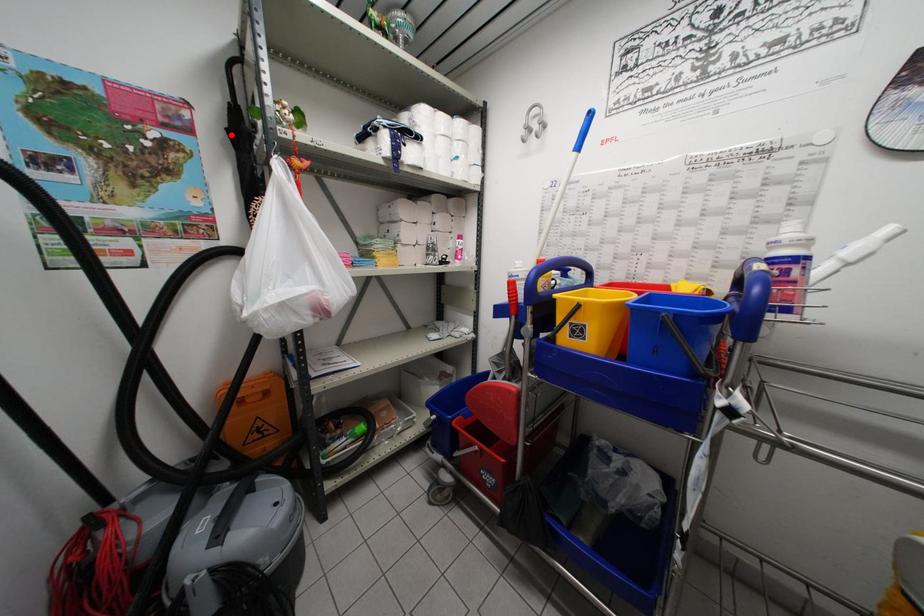
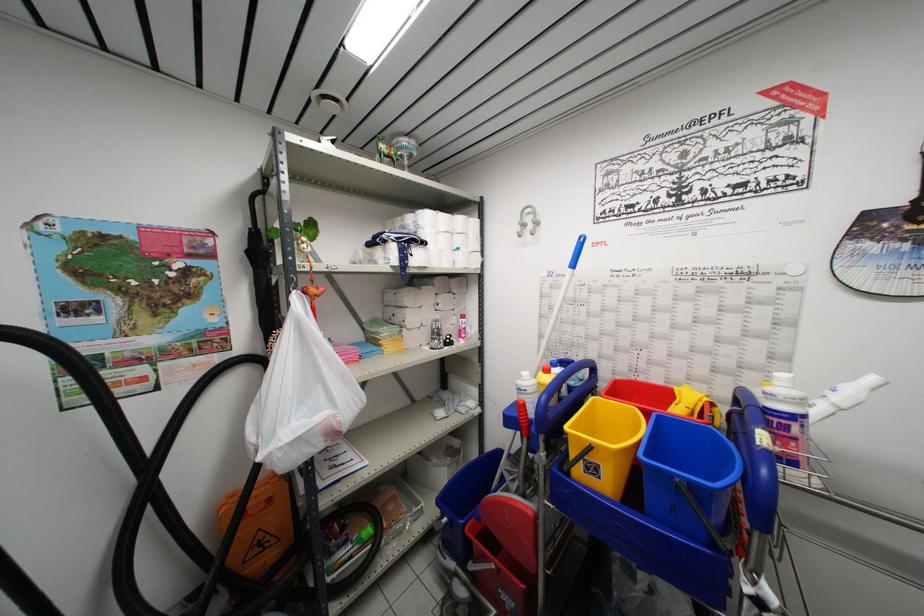
Question: I am providing you with two images of the same scene from different viewpoints. A red point is marked on the first image. At the location where the point appears in image 1, is it still visible in image 2?

Choices:
 (A) Yes
 (B) No

Answer: (A)